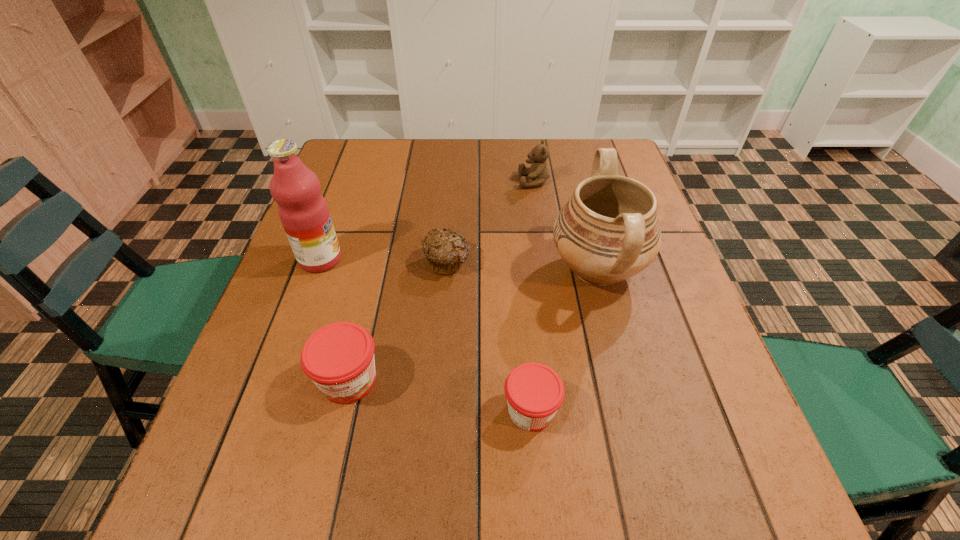
Identify the location of the left jam. The width and height of the screenshot is (960, 540). (339, 358).

What are the coordinates of `the second object from left to right` in the screenshot? It's located at (339, 358).

Identify the location of the shorter jam. (534, 392).

The image size is (960, 540). Identify the location of the second tallest object. (608, 231).

I want to click on the tallest object, so click(x=303, y=211).

Where is `the leftmost object`? the leftmost object is located at coordinates (303, 211).

You are a GUI agent. You are given a task and a screenshot of the screen. Output one action in this format:
    pyautogui.click(x=<x>, y=<y>)
    Task: Click on the teddy bear
    
    Given the screenshot: What is the action you would take?
    pyautogui.click(x=537, y=173)

Locate an element on the screen. This screenshot has height=540, width=960. the fourth object from right to left is located at coordinates (446, 251).

What are the coordinates of `free point located 0.060m on the label side of the second object from left to right` in the screenshot? It's located at (334, 444).

At what (x,y) coordinates should I click in order to perform the action: click on free spot located 0.210m on the label side of the shorter jam. Please return your answer as a coordinate pair (x, y). Looking at the image, I should click on (678, 410).